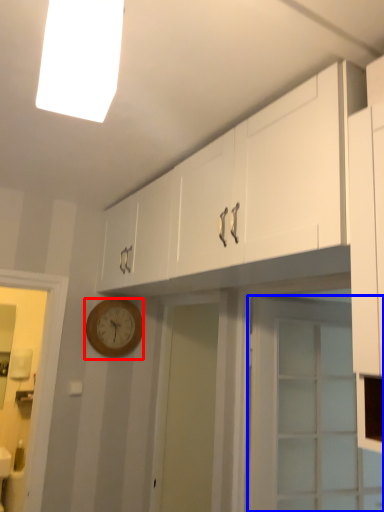
Question: Which object is further to the camera taking this photo, wall clock (highlighted by a red box) or door (highlighted by a blue box)?

Choices:
 (A) wall clock
 (B) door

Answer: (A)